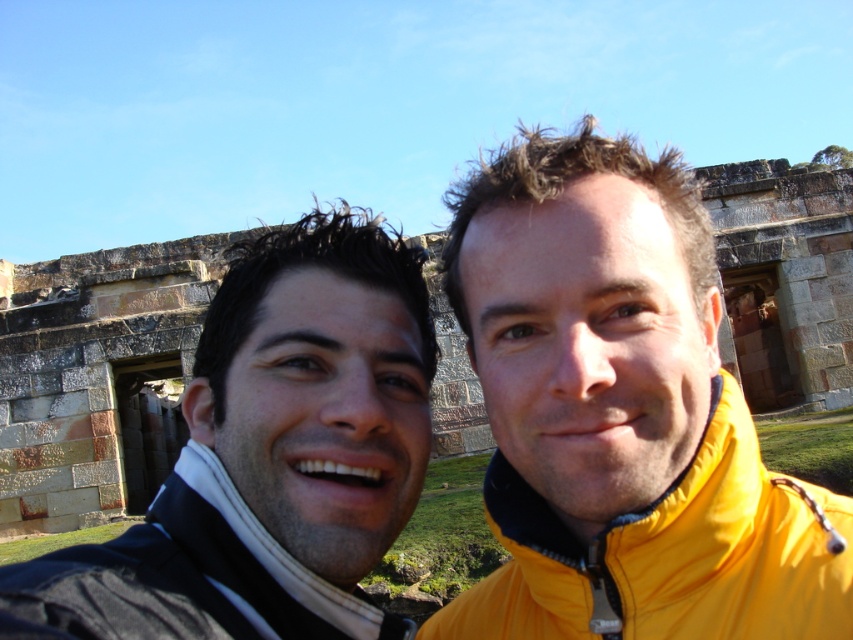
Does yellow fabric jacket at right have a lesser width compared to dark blue fleece jacket at center?

Incorrect, yellow fabric jacket at right's width is not less than dark blue fleece jacket at center's.

Does yellow fabric jacket at right have a larger size compared to dark blue fleece jacket at center?

Correct, yellow fabric jacket at right is larger in size than dark blue fleece jacket at center.

Between point (705, 579) and point (265, 541), which one is positioned behind?

The point (265, 541) is behind.

Where is `yellow fabric jacket at right`? yellow fabric jacket at right is located at coordinates (668, 554).

Is the position of dark brown hair at center less distant than that of yellow fabric jacket at right?

Yes, it is in front of yellow fabric jacket at right.

Which of these two, dark brown hair at center or yellow fabric jacket at right, stands shorter?

yellow fabric jacket at right

Image resolution: width=853 pixels, height=640 pixels. I want to click on dark brown hair at center, so click(270, 456).

At what (x,y) coordinates should I click in order to perform the action: click on dark brown hair at center. Please return your answer as a coordinate pair (x, y). Looking at the image, I should click on (270, 456).

Between dark brown hair at center and dark blue fleece jacket at center, which one is positioned higher?

dark brown hair at center is above.

This screenshot has width=853, height=640. Find the location of `dark brown hair at center`. dark brown hair at center is located at coordinates (270, 456).